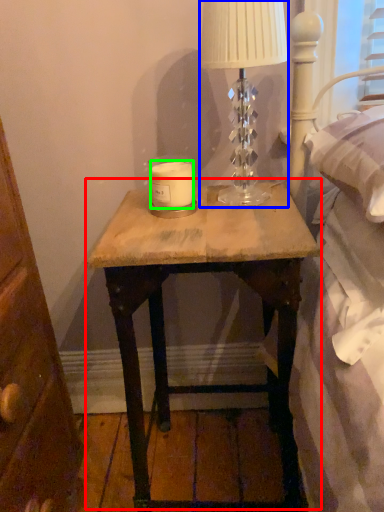
Question: Estimate the real-world distances between objects in this image. Which object is closer to nightstand (highlighted by a red box), table lamp (highlighted by a blue box) or candle (highlighted by a green box)?

Choices:
 (A) table lamp
 (B) candle

Answer: (A)